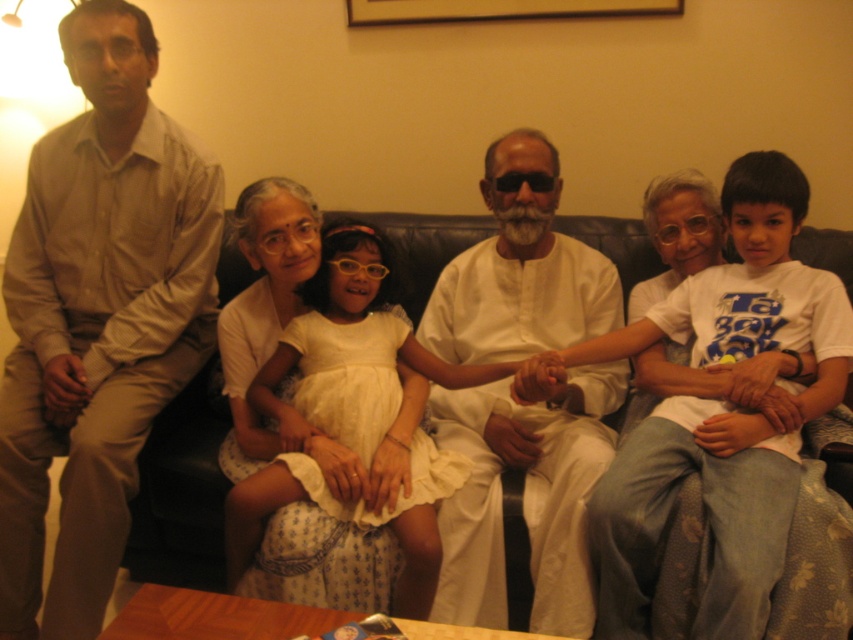
You are a photographer taking a picture of the family gathering. You notice a point at coordinates (97, 317) in the image. What object or clothing item is located at this point?

The point at coordinates (97, 317) marks the location of the matte beige shirt at left.

You are a photographer trying to capture a group photo of the matte beige shirt at left and the white cotton dress at center. Based on their positions, which one should you position closer to the left side of the camera frame?

The matte beige shirt at left should be positioned closer to the left side of the camera frame since it is already to the left of the white cotton dress at center in the scene.

You are a photographer trying to take a clear photo of the white cotton kurta at center and the wooden picture frame at upper center. Which object will appear closer to the camera in the photo?

The white cotton kurta at center will appear closer to the camera because it is in front of the wooden picture frame at upper center.